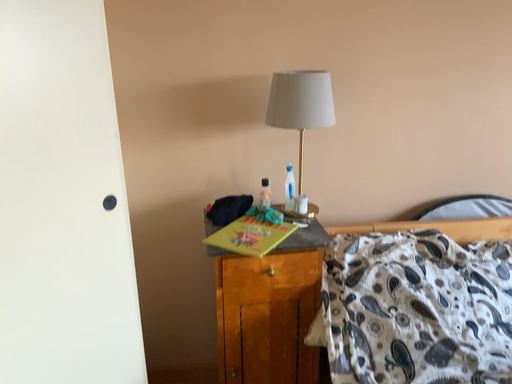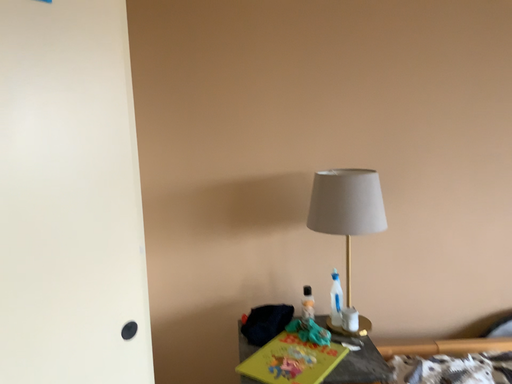
Question: Which way did the camera rotate in the video?

Choices:
 (A) rotated downward
 (B) rotated upward

Answer: (B)